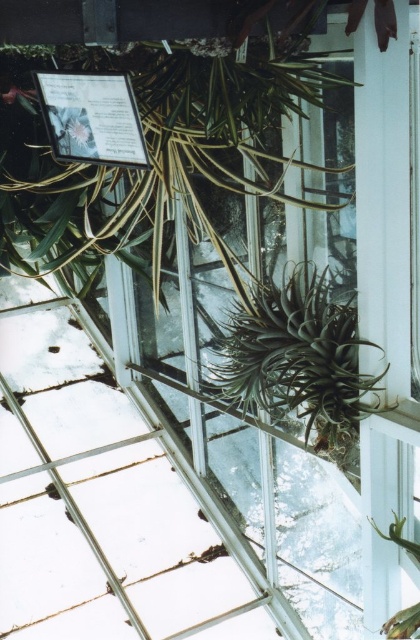
In the scene shown: Does green leafy plant at upper center have a smaller size compared to dark green spiky plant at center?

Actually, green leafy plant at upper center might be larger than dark green spiky plant at center.

Which of these two, green leafy plant at upper center or dark green spiky plant at center, stands shorter?

With less height is dark green spiky plant at center.

Between point (273, 198) and point (307, 388), which one is positioned behind?

Point (273, 198)

At what (x,y) coordinates should I click in order to perform the action: click on green leafy plant at upper center. Please return your answer as a coordinate pair (x, y). Looking at the image, I should click on (157, 154).

Can you confirm if green leafy plant at upper center is bigger than green spiky plant at lower right?

Yes.

Is green leafy plant at upper center smaller than green spiky plant at lower right?

Actually, green leafy plant at upper center might be larger than green spiky plant at lower right.

In the scene shown: Who is more forward, [214,182] or [398,520]?

Point [398,520] is in front.

I want to click on green leafy plant at upper center, so [157, 154].

Can you confirm if green leafy plant at upper center is positioned above matte silver plaque at upper left?

Yes.

How distant is green leafy plant at upper center from matte silver plaque at upper left?

A distance of 37.06 inches exists between green leafy plant at upper center and matte silver plaque at upper left.

Is point (28, 168) more distant than point (107, 157)?

That is True.

You are a GUI agent. You are given a task and a screenshot of the screen. Output one action in this format:
    pyautogui.click(x=<x>, y=<y>)
    Task: Click on the green leafy plant at upper center
    This screenshot has width=420, height=640.
    Given the screenshot: What is the action you would take?
    pyautogui.click(x=157, y=154)